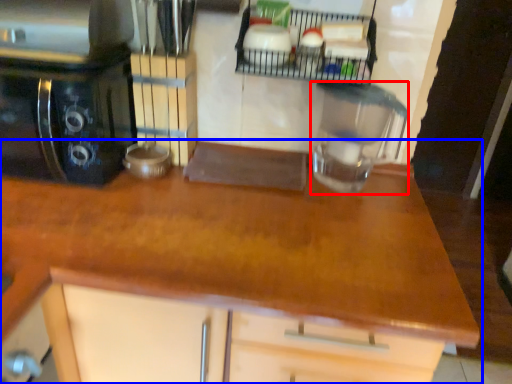
Question: Among these objects, which one is farthest to the camera, kitchen appliance (highlighted by a red box) or countertop (highlighted by a blue box)?

Choices:
 (A) kitchen appliance
 (B) countertop

Answer: (A)